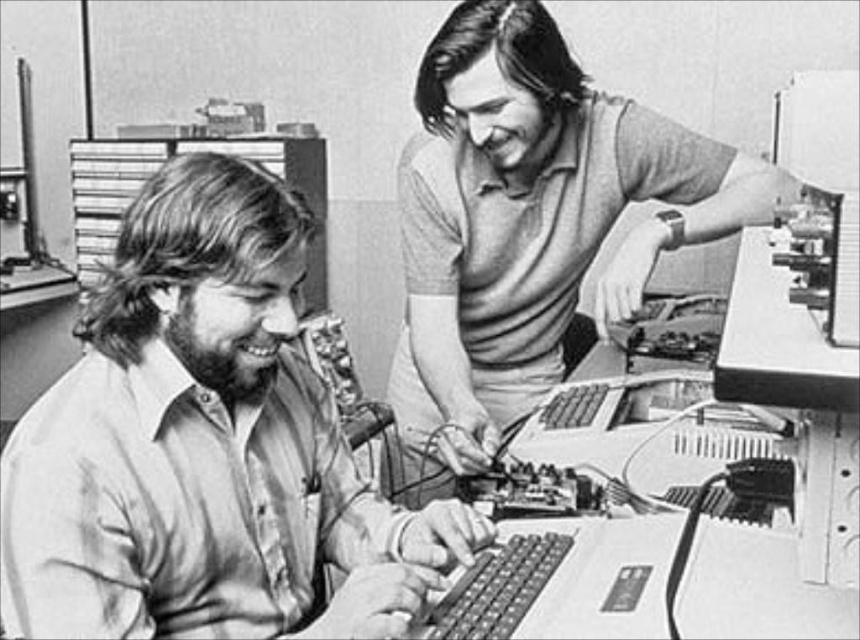
Based on the scene described, which individual is wearing a shirt that is thinner in material? Please refer to the light brown shirt at left and the smooth gray shirt at upper right in your answer.

The light brown shirt at left is thinner than the smooth gray shirt at upper right according to the description.

You are a visitor standing in front of this photograph. You want to know if you can reach the light brown shirt at left without moving your position. Your maximum reaching distance is 36 inches. Can you do it?

The light brown shirt at left and viewer are 38.39 inches apart, which is beyond your maximum reaching distance of 36 inches. Therefore, you cannot reach the light brown shirt at left without moving.

You are a photographer who wants to take a photo of both the light brown shirt at left and the smooth gray shirt at upper right in this scene. Since you can only focus on one shirt at a time, which shirt should you focus on to ensure the other is still in the background?

You should focus on the light brown shirt at left because it is shorter than the smooth gray shirt at upper right, allowing the taller shirt to remain visible in the background.